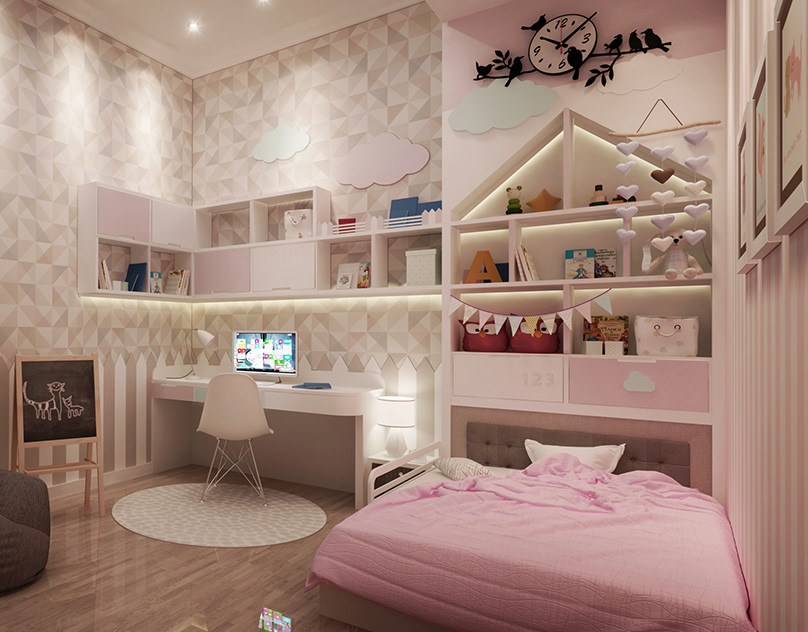
The image size is (808, 632). Identify the location of chalk board. (60, 395).